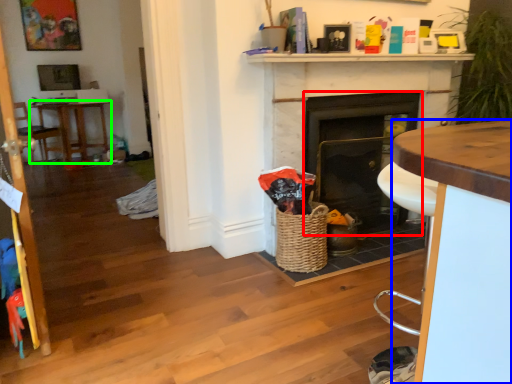
Question: Estimate the real-world distances between objects in this image. Which object is farther from fireplace (highlighted by a red box), desk (highlighted by a blue box) or table (highlighted by a green box)?

Choices:
 (A) desk
 (B) table

Answer: (B)